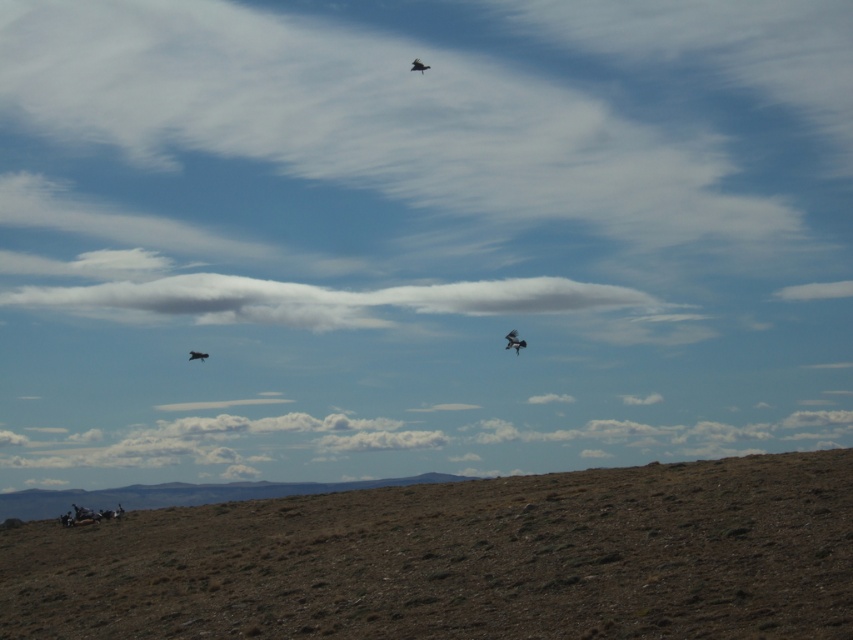
What do you see at coordinates (514, 340) in the screenshot? Image resolution: width=853 pixels, height=640 pixels. I see `dark brown feathers at center` at bounding box center [514, 340].

Which is more to the right, dark brown feathers at center or dark brown feathered bird at upper center?

Positioned to the right is dark brown feathers at center.

Does point (512, 339) come in front of point (189, 353)?

That is True.

The height and width of the screenshot is (640, 853). What are the coordinates of `dark brown feathers at center` in the screenshot? It's located at (514, 340).

Measure the distance between point (595, 298) and camera.

The distance of point (595, 298) from camera is 41.55 meters.

Measure the distance between white fluffy cloud at center and camera.

white fluffy cloud at center and camera are 39.73 meters apart from each other.

Between point (241, 310) and point (415, 60), which one is positioned behind?

Point (241, 310)

The image size is (853, 640). In order to click on white fluffy cloud at center in this screenshot , I will do `click(331, 300)`.

Does white fluffy cloud at center lie behind dark brown feathered bird at upper center?

Yes, it is.

Image resolution: width=853 pixels, height=640 pixels. Describe the element at coordinates (331, 300) in the screenshot. I see `white fluffy cloud at center` at that location.

Who is more distant from viewer, (195,321) or (206,353)?

The point (195,321) is behind.

Locate an element on the screen. The height and width of the screenshot is (640, 853). white fluffy cloud at center is located at coordinates point(331,300).